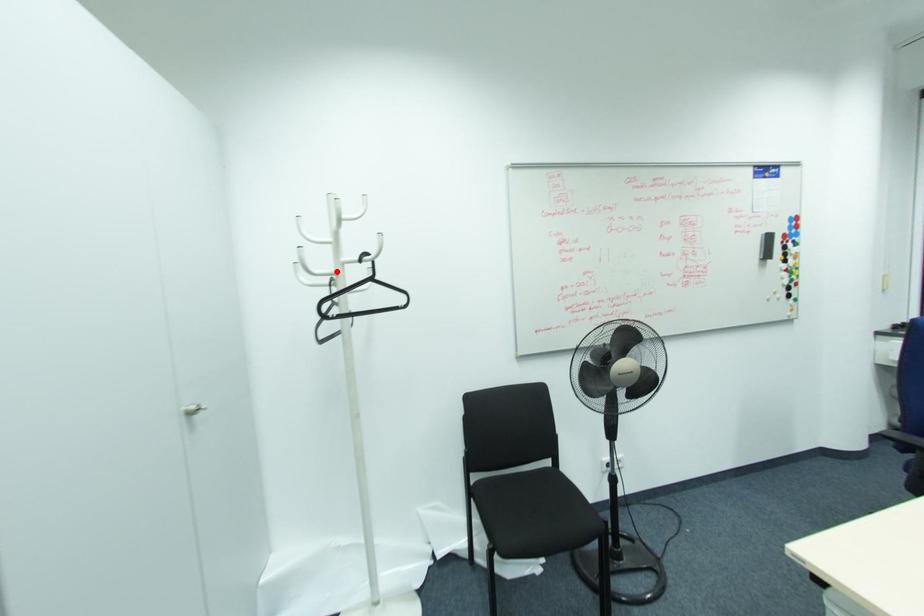
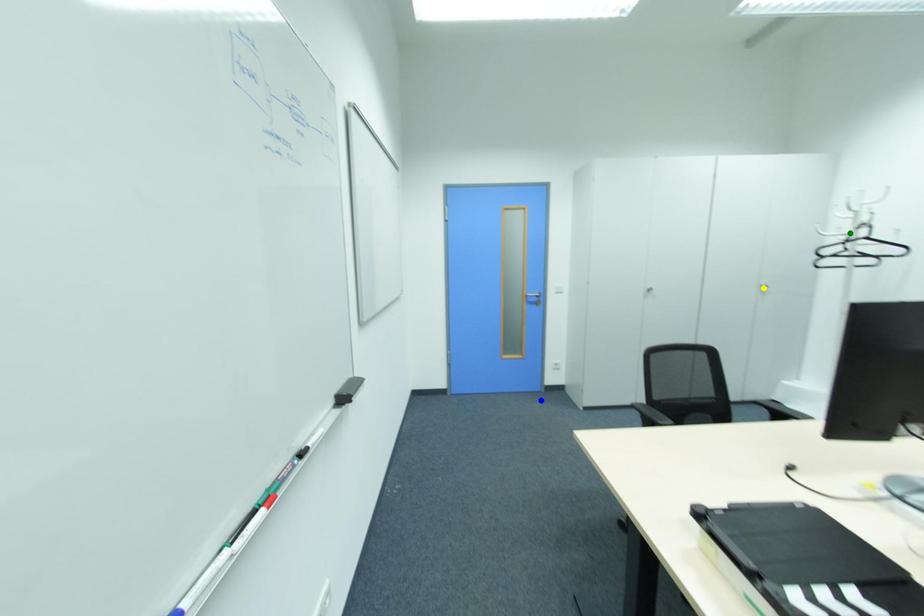
Question: I am providing you with two images of the same scene from different viewpoints. A red point is marked on the first image. You are given multiple points on the second image. Can you choose the point in image 2 that corresponds to the point in image 1?

Choices:
 (A) green point
 (B) blue point
 (C) yellow point

Answer: (A)